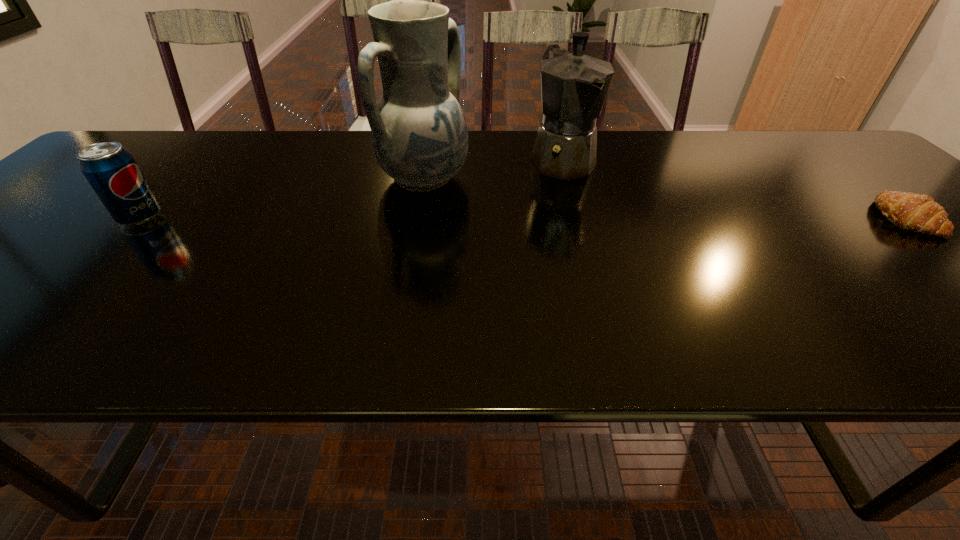
Find the location of `vacant space located 0.350m on the front-facing side of the third object from right to left`. vacant space located 0.350m on the front-facing side of the third object from right to left is located at coordinates click(596, 247).

Image resolution: width=960 pixels, height=540 pixels. I want to click on vacant space situated on the front-facing side of the third object from right to left, so click(x=544, y=227).

Identify the location of vacant point located 0.330m on the front-facing side of the third object from right to left. (588, 244).

Where is `free space located 0.250m on the pouring side of the second tallest object`? The image size is (960, 540). free space located 0.250m on the pouring side of the second tallest object is located at coordinates (635, 246).

At what (x,y) coordinates should I click in order to perform the action: click on vacant space located on the pouring side of the second tallest object. Please return your answer as a coordinate pair (x, y). Looking at the image, I should click on (608, 217).

Locate an element on the screen. vacant region located on the pouring side of the second tallest object is located at coordinates (595, 202).

Where is `pitcher located at the far edge`? pitcher located at the far edge is located at coordinates (419, 135).

Image resolution: width=960 pixels, height=540 pixels. What are the coordinates of `coffeepot that is at the far edge` in the screenshot? It's located at (574, 86).

Locate an element on the screen. This screenshot has width=960, height=540. object that is at the right edge is located at coordinates (916, 212).

This screenshot has width=960, height=540. What are the coordinates of `free spot at the far edge of the desktop` in the screenshot? It's located at (516, 145).